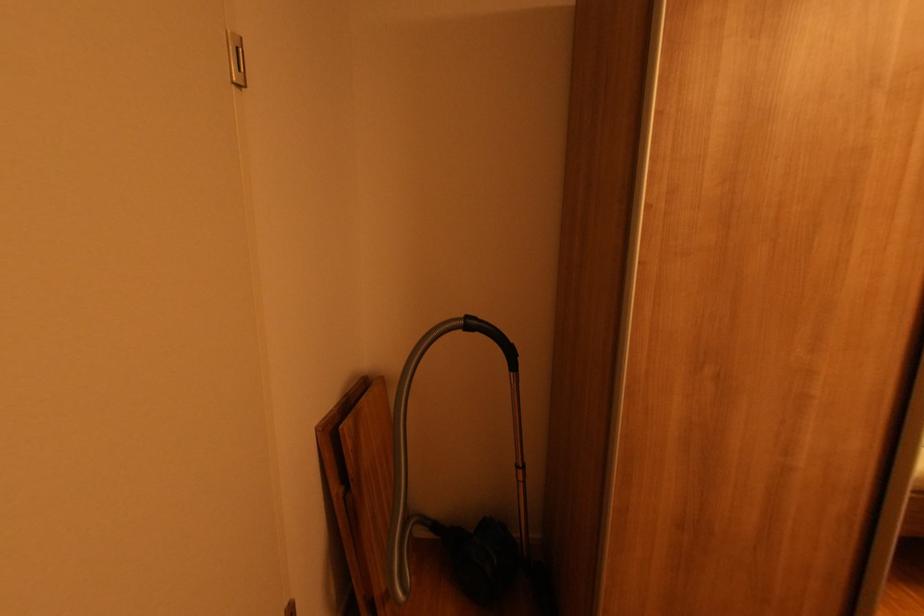
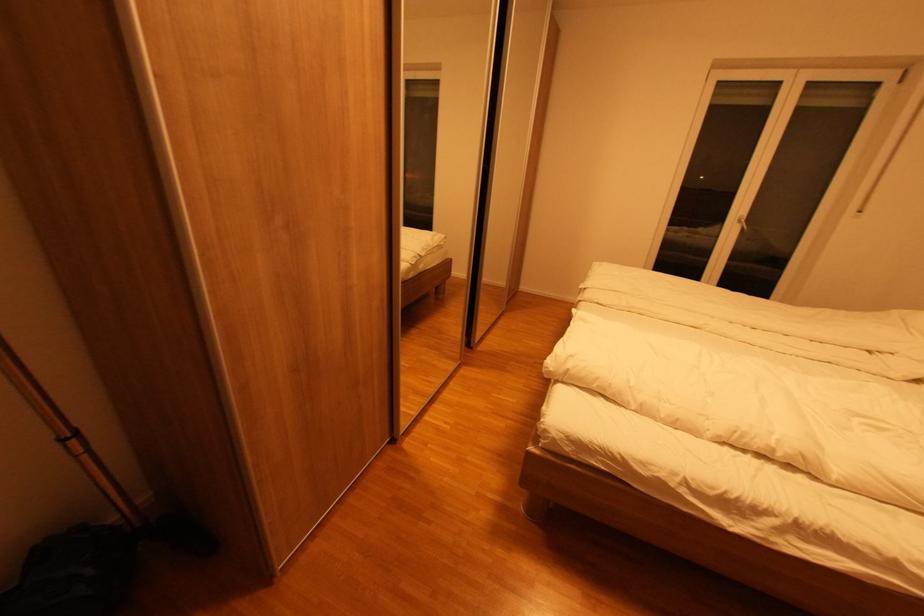
Find the pixel in the second image that matches (529,468) in the first image.

(83, 434)